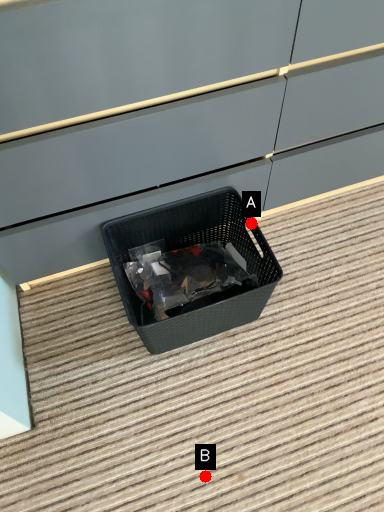
Question: Two points are circled on the image, labeled by A and B beside each circle. Which point appears closest to the camera in this image?

Choices:
 (A) A is closer
 (B) B is closer

Answer: (B)